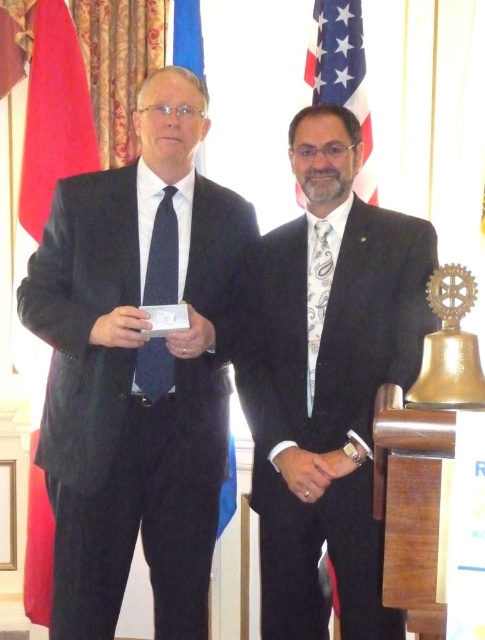
You are an event planner arranging a photo shoot for the ceremony. You need to ensure that the American flag at upper center is positioned so that its width is greater than the white paisley tie at center. Is this currently the case in the image?

Yes, the American flag at upper center has a greater width than the white paisley tie at center, as stated in the description.

You are organizing a formal event and need to ensure that the matte black suit at center and the white paisley tie at center are displayed properly. Based on their sizes, which one should be placed in a larger display area to accommodate their dimensions?

The matte black suit at center has a larger size compared to the white paisley tie at center, so it should be placed in a larger display area to accommodate its dimensions.

You are a photographer standing at the camera position. You want to adjust your lens to focus on the red fabric flag at left without moving your position. What is the minimum distance your lens needs to focus on to capture the flag clearly?

The minimum distance your lens needs to focus on is 2.67 meters, as the red fabric flag at left is located exactly 2.67 meters away from the camera.